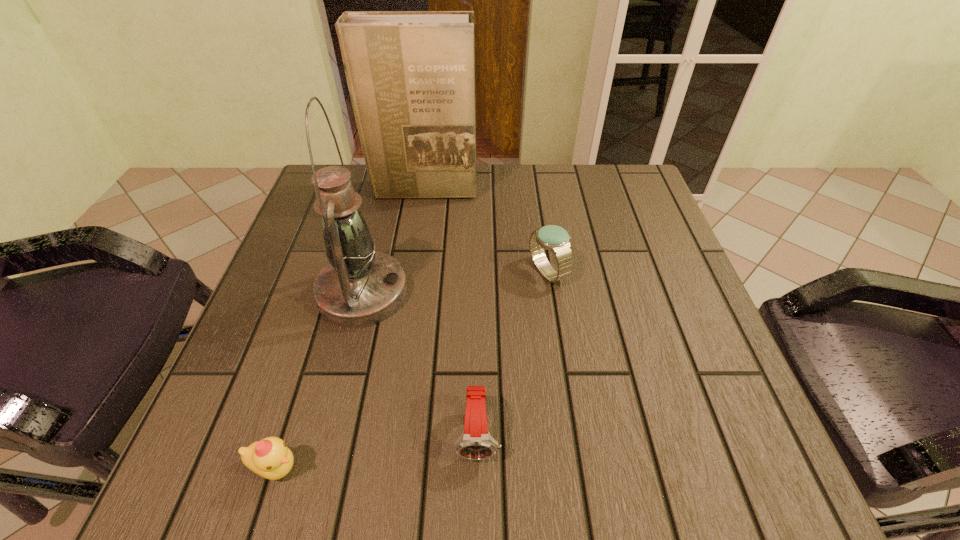
This screenshot has width=960, height=540. Find the location of `vacant area that lies between the rightmost object and the left watch`. vacant area that lies between the rightmost object and the left watch is located at coordinates (513, 353).

The width and height of the screenshot is (960, 540). What are the coordinates of `free space that is in between the nearer watch and the farthest object` in the screenshot? It's located at (451, 312).

The width and height of the screenshot is (960, 540). What are the coordinates of `blank region between the left watch and the duckling` in the screenshot? It's located at (376, 451).

Locate an element on the screen. vacant space that's between the farthest object and the left watch is located at coordinates (451, 312).

You are a GUI agent. You are given a task and a screenshot of the screen. Output one action in this format:
    pyautogui.click(x=<x>, y=<y>)
    Task: Click on the object that can be found as the third closest to the duckling
    The image size is (960, 540).
    Given the screenshot: What is the action you would take?
    pyautogui.click(x=555, y=238)

Find the location of a particular element. This screenshot has width=960, height=540. object that can be found as the second closest to the left watch is located at coordinates (270, 458).

At what (x,y) coordinates should I click in order to perform the action: click on free location that satisfies the following two spatial constraints: 1. on the cover of the farthest object; 2. on the front-facing side of the duckling. Please return your answer as a coordinate pair (x, y). This screenshot has height=540, width=960. Looking at the image, I should click on (382, 468).

The height and width of the screenshot is (540, 960). I want to click on vacant space that satisfies the following two spatial constraints: 1. on the cover of the farthest object; 2. on the front-facing side of the duckling, so click(382, 468).

Where is `vacant space that satisfies the following two spatial constraints: 1. on the cover of the rightmost object; 2. on the left side of the phonebook`? Image resolution: width=960 pixels, height=540 pixels. vacant space that satisfies the following two spatial constraints: 1. on the cover of the rightmost object; 2. on the left side of the phonebook is located at coordinates (412, 272).

The width and height of the screenshot is (960, 540). I want to click on vacant region that satisfies the following two spatial constraints: 1. on the cover of the farthest object; 2. on the front-facing side of the duckling, so point(382,468).